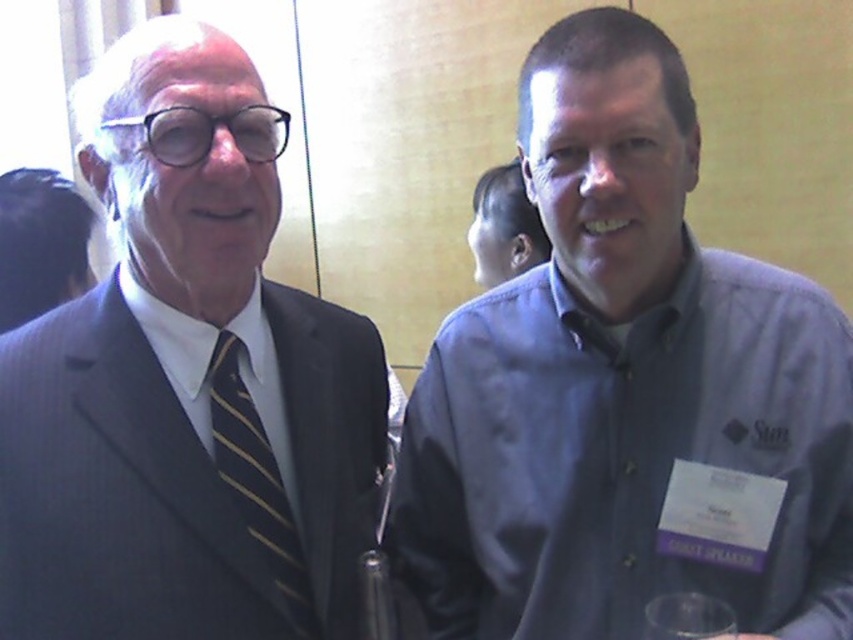
Can you confirm if blue cotton shirt at center is positioned to the left of matte black suit at left?

Incorrect, blue cotton shirt at center is not on the left side of matte black suit at left.

Looking at this image, which is below, blue cotton shirt at center or matte black suit at left?

blue cotton shirt at center is lower down.

Is point (764, 632) positioned in front of point (225, 364)?

No, it is behind (225, 364).

Image resolution: width=853 pixels, height=640 pixels. Find the location of `blue cotton shirt at center`. blue cotton shirt at center is located at coordinates (622, 385).

Is blue cotton shirt at center shorter than black striped tie at left?

No, blue cotton shirt at center is not shorter than black striped tie at left.

Is blue cotton shirt at center to the left of black striped tie at left from the viewer's perspective?

No, blue cotton shirt at center is not to the left of black striped tie at left.

Image resolution: width=853 pixels, height=640 pixels. In order to click on blue cotton shirt at center in this screenshot , I will do `click(622, 385)`.

Who is lower down, matte black suit at left or black striped tie at left?

black striped tie at left is lower down.

Which of these two, matte black suit at left or black striped tie at left, stands taller?

matte black suit at left is taller.

Describe the element at coordinates (187, 385) in the screenshot. I see `matte black suit at left` at that location.

Identify the location of matte black suit at left. (187, 385).